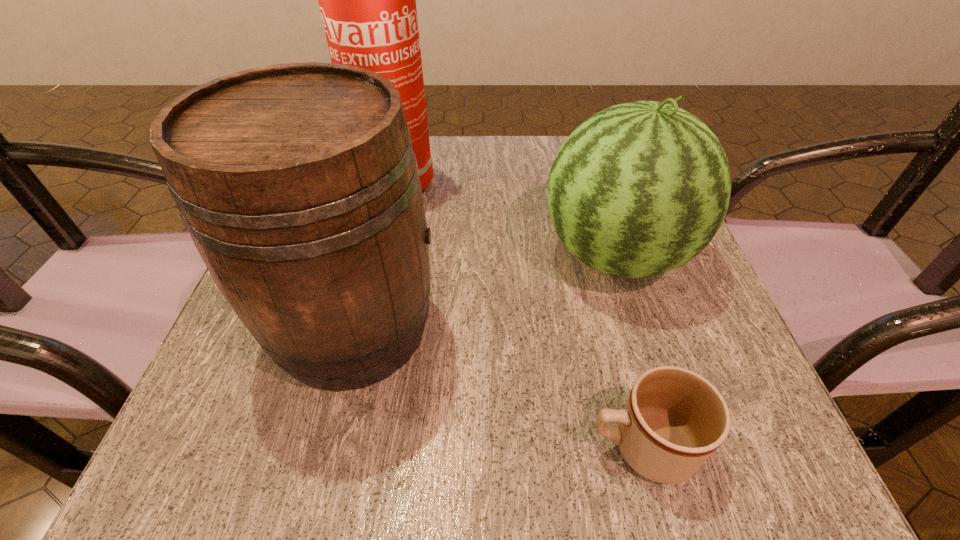
Locate an element on the screen. the farthest object is located at coordinates (367, 0).

Identify the location of fire extinguisher. (367, 0).

Find the location of a particular element. cider is located at coordinates (297, 182).

At what (x,y) coordinates should I click in order to perform the action: click on the third tallest object. Please return your answer as a coordinate pair (x, y). The image size is (960, 540). Looking at the image, I should click on point(639,189).

Where is `mug`? The height and width of the screenshot is (540, 960). mug is located at coordinates (673, 420).

Locate an element on the screen. the shortest object is located at coordinates (673, 420).

This screenshot has height=540, width=960. Find the location of `vacant region located at the nozzle of the farthest object`. vacant region located at the nozzle of the farthest object is located at coordinates [x=608, y=185].

Locate an element on the screen. This screenshot has height=540, width=960. vacant region located 0.190m on the side of the cider near the bung hole is located at coordinates (564, 328).

This screenshot has height=540, width=960. In order to click on vacant position located 0.220m on the left of the third tallest object in this screenshot , I will do `click(417, 255)`.

Find the location of a particular element. The height and width of the screenshot is (540, 960). free point located 0.130m on the side of the shortest object with the handle is located at coordinates (482, 446).